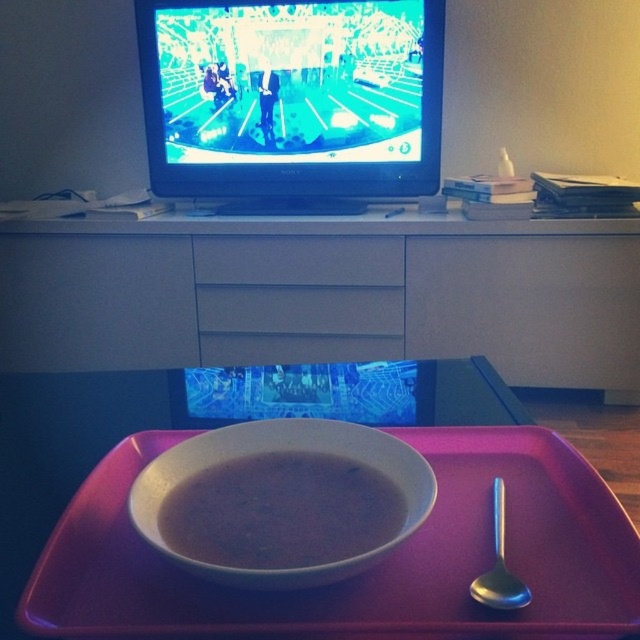
Where is `white speckled bowl at center`? Image resolution: width=640 pixels, height=640 pixels. white speckled bowl at center is located at coordinates (280, 451).

Is point (164, 461) less distant than point (211, 237)?

That is True.

Locate an element on the screen. This screenshot has height=640, width=640. white speckled bowl at center is located at coordinates (280, 451).

Does matte white cabinet at upper center have a greater width compared to matte white drawer at center?

Correct, the width of matte white cabinet at upper center exceeds that of matte white drawer at center.

Find the location of a particular element. The height and width of the screenshot is (640, 640). matte white cabinet at upper center is located at coordinates (324, 292).

Locate an element on the screen. This screenshot has height=640, width=640. matte white cabinet at upper center is located at coordinates (324, 292).

Is pink plastic tray at center closer to the viewer compared to matte white drawer at center?

Yes, pink plastic tray at center is in front of matte white drawer at center.

Is pink plastic tray at center further to camera compared to matte white drawer at center?

No, it is in front of matte white drawer at center.

Who is more distant from viewer, (522, 428) or (276, 237)?

The point (276, 237) is more distant.

At what (x,y) coordinates should I click in order to perform the action: click on pink plastic tray at center. Please return your answer as a coordinate pair (x, y). Looking at the image, I should click on (369, 570).